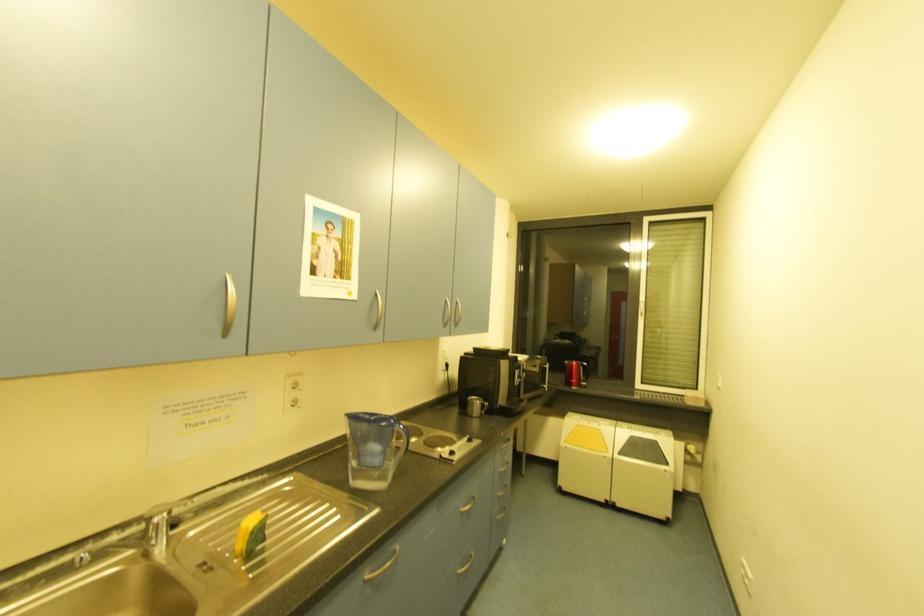
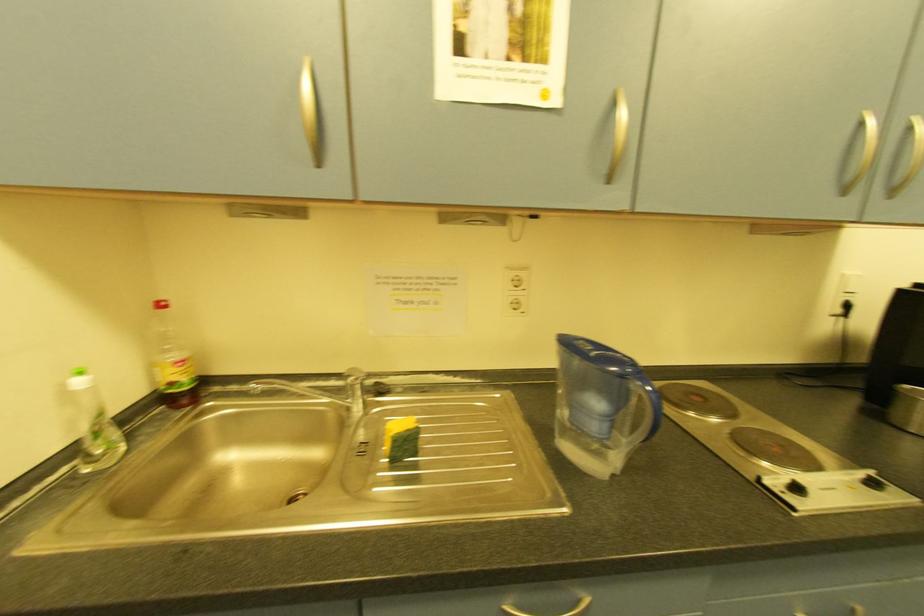
Question: Based on the continuous images, in which direction is the camera rotating? Reply with the corresponding letter.

Choices:
 (A) Left
 (B) Right
 (C) Up
 (D) Down

Answer: (A)